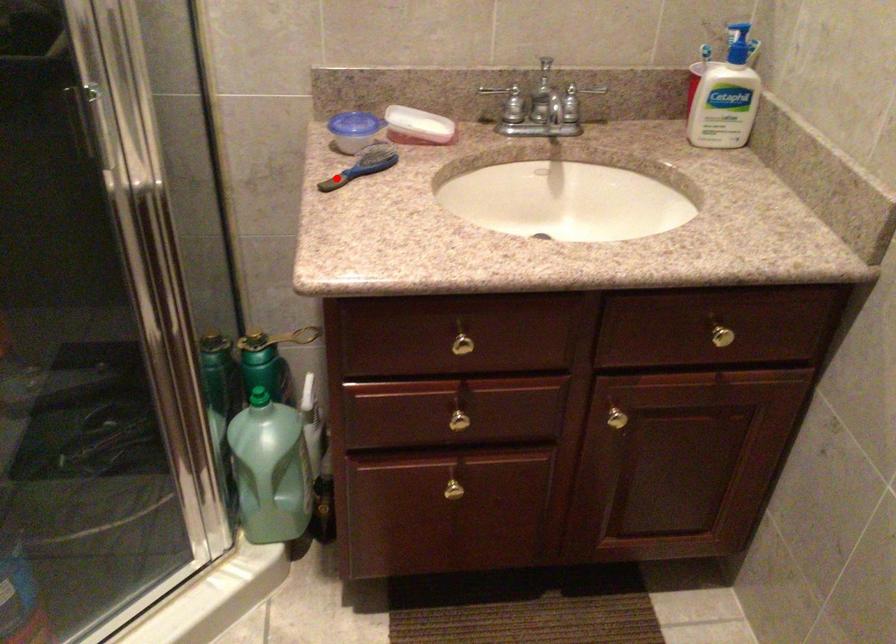
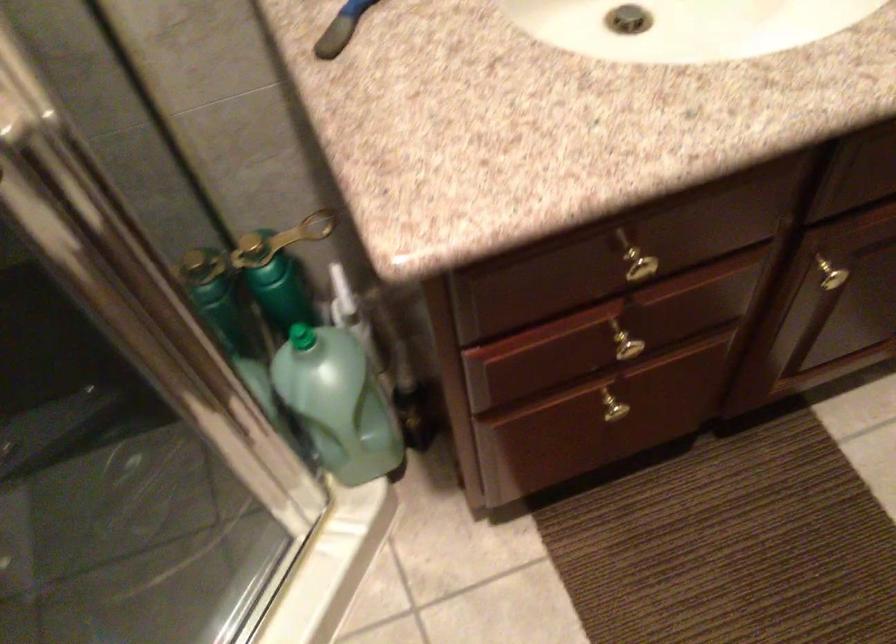
Question: I am providing you with two images of the same scene from different viewpoints. Given a red point in image1, look at the same physical point in image2. Is it:

Choices:
 (A) Closer to the viewpoint
 (B) Farther from the viewpoint

Answer: (A)